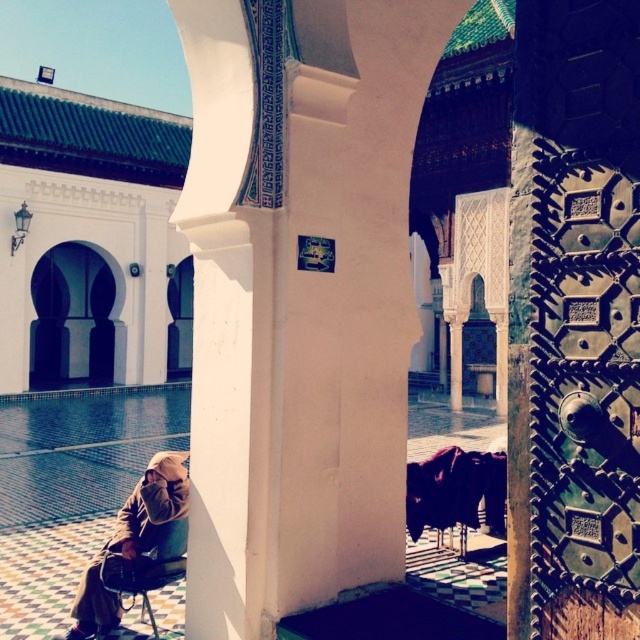
You are a GUI agent. You are given a task and a screenshot of the screen. Output one action in this format:
    pyautogui.click(x=<x>, y=<y>)
    Task: Click on the brown suede robe at lower left
    The height and width of the screenshot is (640, 640).
    Given the screenshot: What is the action you would take?
    pyautogui.click(x=138, y=547)

Locate an element on the screen. brown suede robe at lower left is located at coordinates (138, 547).